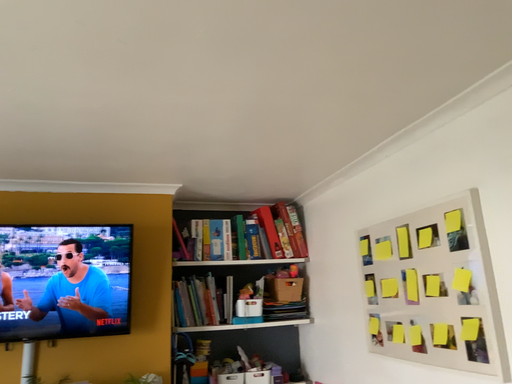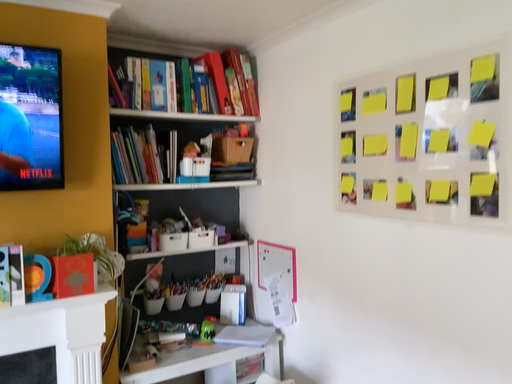
Question: Which way did the camera rotate in the video?

Choices:
 (A) rotated downward
 (B) rotated upward

Answer: (A)